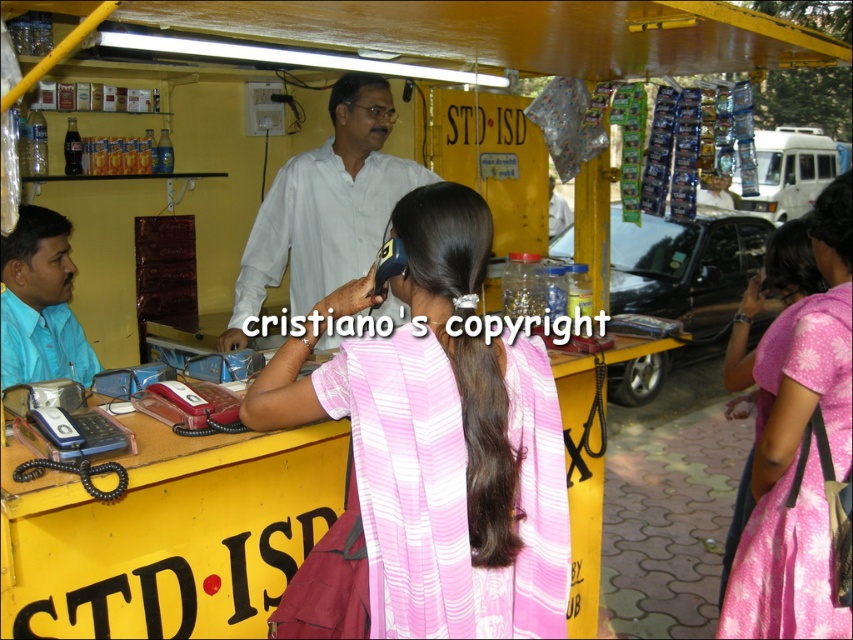
You are standing at point (x=345, y=99) and want to walk to the yellow mobile phone booth labeled STD ISD. Is the point (x=16, y=221) between you and the booth?

Yes, the point (x=16, y=221) is between you and the booth because it is in front of point (x=345, y=99) where you are standing.

You are a customer in the STD ISD phone booth and see two people with brown matte hair at left and brown matte hair at center. Which one is more to the left?

The brown matte hair at left is more to the left than the brown matte hair at center.

You are a customer waiting outside the STD ISD booth. You see two people inside the booth, a matte blue shirt at left and a brown matte hair at left. Which person is closer to the entrance of the booth?

The brown matte hair at left is closer to the entrance of the booth because the matte blue shirt at left is to the right of brown matte hair at left, meaning the brown matte hair at left is positioned further left and thus closer to the entrance.